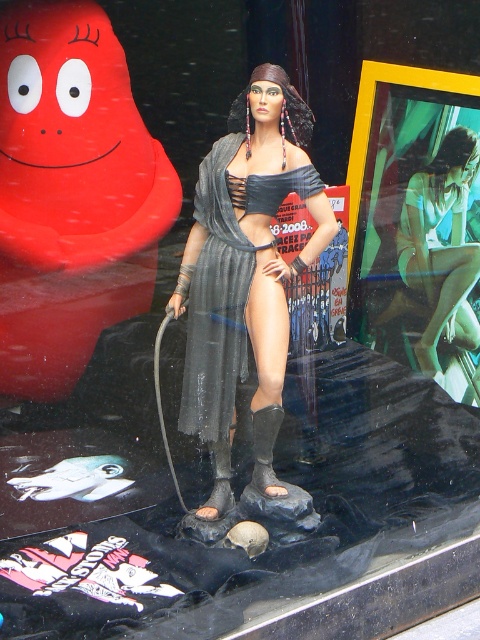
You are an interior designer assessing the display window. You notice the gray fabric dress at center and the matte green shorts at center. Which item is shorter in height?

The gray fabric dress at center is shorter in height compared to the matte green shorts at center.

You are a window designer checking the display window. You need to ensure that the matte red rubber at upper left and the gray fabric dress at center are visible to someone standing outside. Since the display window has a height limit of 1.8 meters, can both objects be seen without any obstruction?

The matte red rubber at upper left is taller than the gray fabric dress at center. Since the taller object is the matte red rubber at upper left, it might block the view of the gray fabric dress at center if placed directly in front. To ensure both are visible, adjust their positions so the shorter gray fabric dress at center is in front or move them apart to avoid obstruction.

You are a photographer setting up for a shoot in front of the display window. You need to place a small tripod exactly 2 meters away from the matte red rubber at upper left. Considering the scene described, can you position the tripod in the available space without moving any existing objects?

The matte red rubber at upper left is 2.04 meters away from the camera. To place the tripod 2 meters from the matte red rubber at upper left, you would need to position it slightly closer to the rubber than the current camera distance. Since the scene doesn